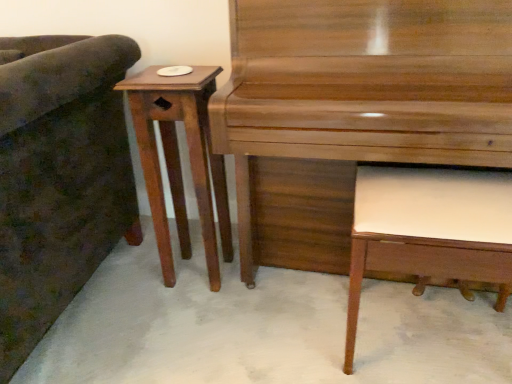
This screenshot has width=512, height=384. In order to click on vacant space situated on the left part of white leather music stool at lower right in this screenshot , I will do `click(291, 325)`.